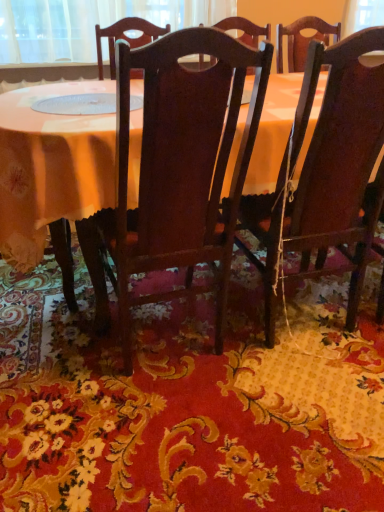
I want to click on vacant space in front of dark wood chair at center, the 2th chair from the right, so click(171, 442).